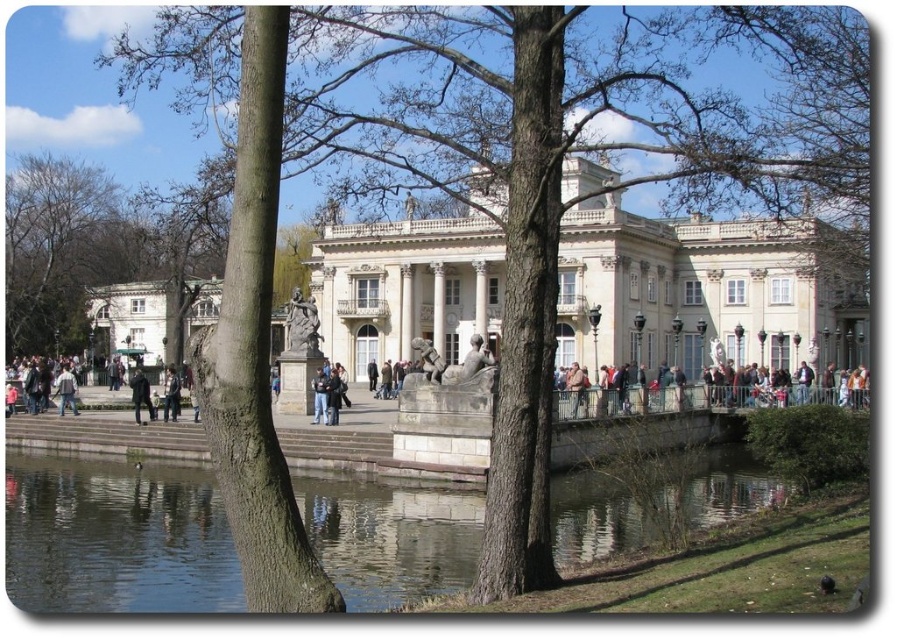
Question: Is bare wood tree at upper left to the right of white stone palace at left from the viewer's perspective?

Choices:
 (A) yes
 (B) no

Answer: (B)

Question: Which object is closer to the camera taking this photo?

Choices:
 (A) dark blue jeans at center
 (B) denim pants at center

Answer: (B)

Question: Is white marble palace at center wider than light brown leather jacket at lower left?

Choices:
 (A) no
 (B) yes

Answer: (B)

Question: Estimate the real-world distances between objects in this image. Which object is closer to the dark blue jacket at center?

Choices:
 (A) dark blue jeans at center
 (B) white stone palace at left

Answer: (A)

Question: Does clear water at pond center appear on the left side of dark blue jeans at center?

Choices:
 (A) yes
 (B) no

Answer: (B)

Question: Which of the following is the farthest from the observer?

Choices:
 (A) white stone palace at left
 (B) clear water at pond center
 (C) white marble palace at center
 (D) denim pants at center

Answer: (A)